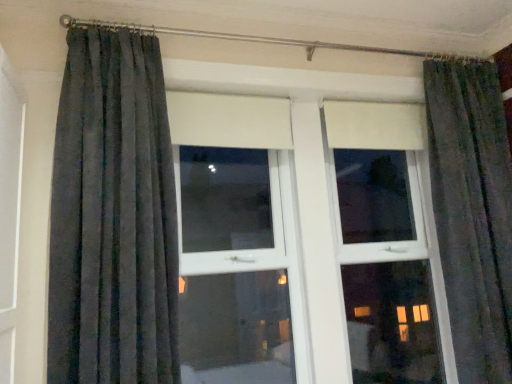
Question: From a real-world perspective, is dark grey textured curtain at left above or below matte gray curtains at center?

Choices:
 (A) above
 (B) below

Answer: (A)

Question: Considering the positions of dark grey textured curtain at left and matte gray curtains at center in the image, is dark grey textured curtain at left wider or thinner than matte gray curtains at center?

Choices:
 (A) thin
 (B) wide

Answer: (A)

Question: From the image's perspective, is dark grey textured curtain at left above or below matte gray curtains at center?

Choices:
 (A) below
 (B) above

Answer: (B)

Question: Based on their sizes in the image, would you say matte gray curtains at center is bigger or smaller than dark grey textured curtain at left?

Choices:
 (A) small
 (B) big

Answer: (B)

Question: From the image's perspective, is matte gray curtains at center above or below dark grey textured curtain at left?

Choices:
 (A) above
 (B) below

Answer: (B)

Question: Considering the positions of matte gray curtains at center and dark grey textured curtain at left in the image, is matte gray curtains at center wider or thinner than dark grey textured curtain at left?

Choices:
 (A) wide
 (B) thin

Answer: (A)

Question: Would you say matte gray curtains at center is inside or outside dark grey textured curtain at left?

Choices:
 (A) inside
 (B) outside

Answer: (B)